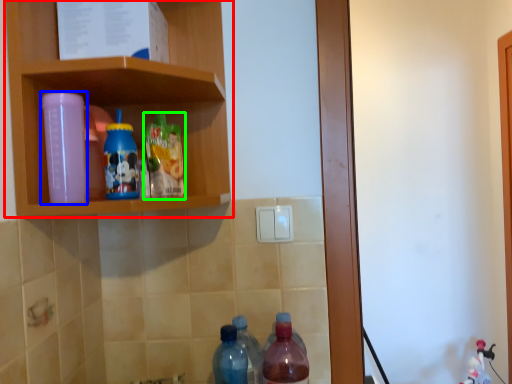
Question: Estimate the real-world distances between objects in this image. Which object is farther from shelf (highlighted by a red box), bottle (highlighted by a blue box) or bottle (highlighted by a green box)?

Choices:
 (A) bottle
 (B) bottle

Answer: (A)